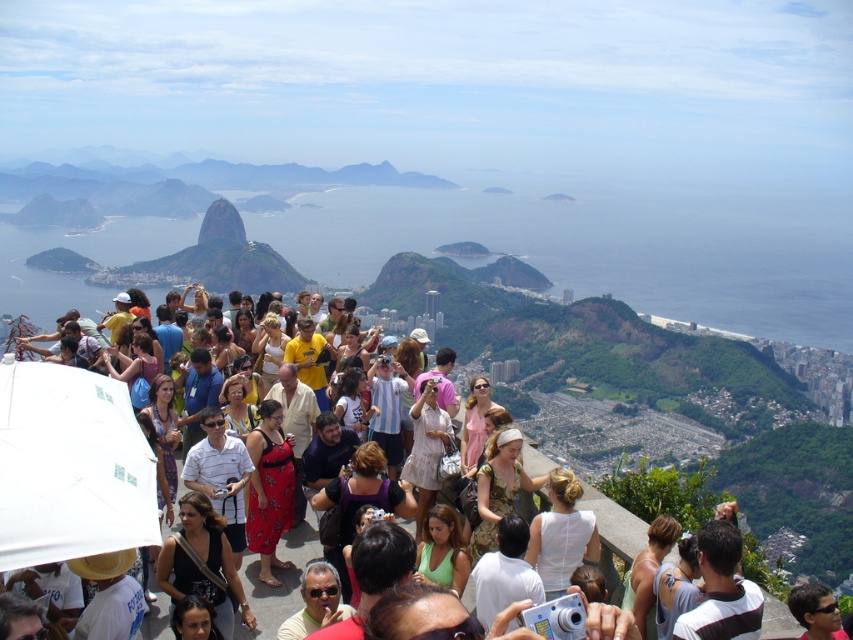
Can you confirm if green floral dress at center is smaller than light brown hair at center?

No, green floral dress at center is not smaller than light brown hair at center.

Between point (480, 508) and point (672, 528), which one is positioned behind?

The point (480, 508) is behind.

Locate an element on the screen. The width and height of the screenshot is (853, 640). green floral dress at center is located at coordinates (498, 486).

Does point (253, 435) come in front of point (167, 403)?

Yes, point (253, 435) is closer to viewer.

The image size is (853, 640). What are the coordinates of `red floral dress at center` in the screenshot? It's located at (270, 488).

How much distance is there between green matte dress at center and printed cotton dress at center?

A distance of 175.22 meters exists between green matte dress at center and printed cotton dress at center.

Who is more forward, (448,554) or (161,417)?

Point (448,554)

Where is `green matte dress at center`? This screenshot has height=640, width=853. green matte dress at center is located at coordinates (442, 548).